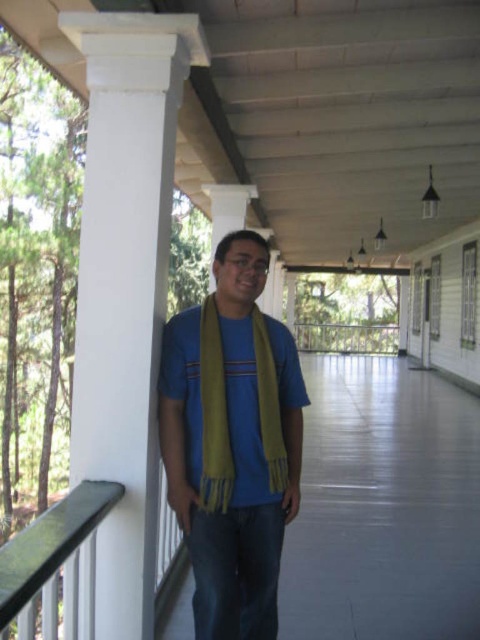
Who is more forward, (142,616) or (262,426)?

Positioned in front is point (262,426).

Is white smooth column at left wider than green soft scarf at center?

Yes, white smooth column at left is wider than green soft scarf at center.

Image resolution: width=480 pixels, height=640 pixels. Describe the element at coordinates (126, 288) in the screenshot. I see `white smooth column at left` at that location.

Image resolution: width=480 pixels, height=640 pixels. In order to click on white smooth column at left in this screenshot , I will do `click(126, 288)`.

Between white smooth column at left and yellow scarf at center, which one has more height?

white smooth column at left is taller.

Can you confirm if white smooth column at left is smaller than yellow scarf at center?

Yes, white smooth column at left is smaller than yellow scarf at center.

Which is behind, point (108, 320) or point (376, 476)?

Point (376, 476)

You are a GUI agent. You are given a task and a screenshot of the screen. Output one action in this format:
    pyautogui.click(x=<x>, y=<y>)
    Task: Click on the white smooth column at left
    Image resolution: width=480 pixels, height=640 pixels.
    Given the screenshot: What is the action you would take?
    pyautogui.click(x=126, y=288)

Is white smooth column at left positioned in front of black plastic balustrade at lower left?

That is False.

Does white smooth column at left have a greater height compared to black plastic balustrade at lower left?

Yes.

Which is behind, point (144, 579) or point (47, 627)?

The point (144, 579) is more distant.

Locate an element on the screen. white smooth column at left is located at coordinates (126, 288).